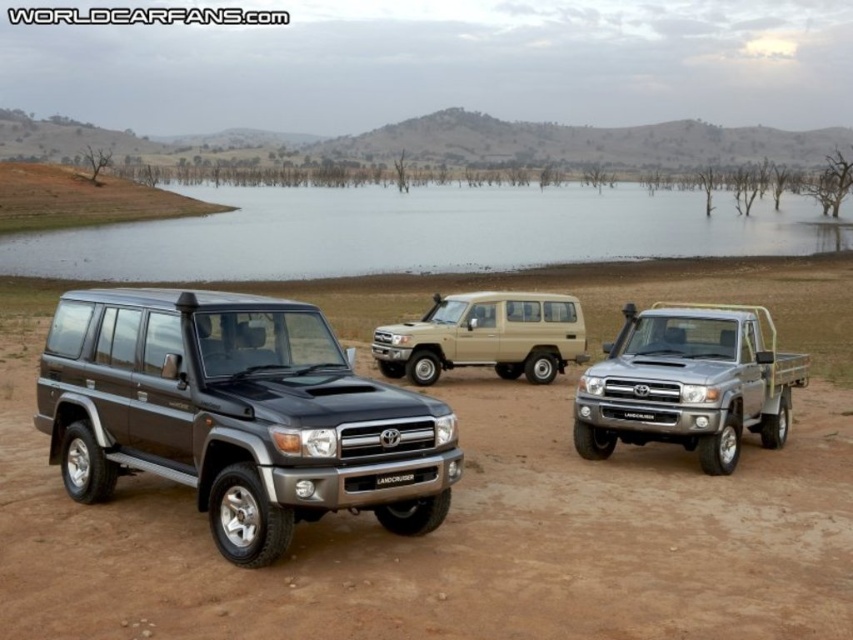
You are a driver planning to navigate the brown matte dirt track at center while avoiding obstacles. Considering the beige matte suv at center is parked there, can you safely pass it without going off the track?

The brown matte dirt track at center is taller than beige matte suv at center, so the track has enough vertical clearance for the SUV to pass safely without needing to leave the track.

Based on the photo, you are a photographer planning to capture a landscape shot that includes both the clear water at lake center and the beige matte suv at center. Based on their relative heights, which object should you position closer to the foreground to ensure both are clearly visible in the frame?

The clear water at lake center has a greater height compared to the beige matte suv at center. To ensure both are clearly visible in the frame, position the beige matte suv at center closer to the foreground since it is shorter than the clear water at lake center.

You are planning to drive a Toyota Land Cruiser along the brown matte dirt track at center. Based on the scene description, can you determine if the track is suitable for offroad driving?

The brown matte dirt track at center is located on dry, reddish brown dirt terrain which is suitable for offroad driving as all the vehicles in the scene are rugged Land Cruisers designed for such conditions.